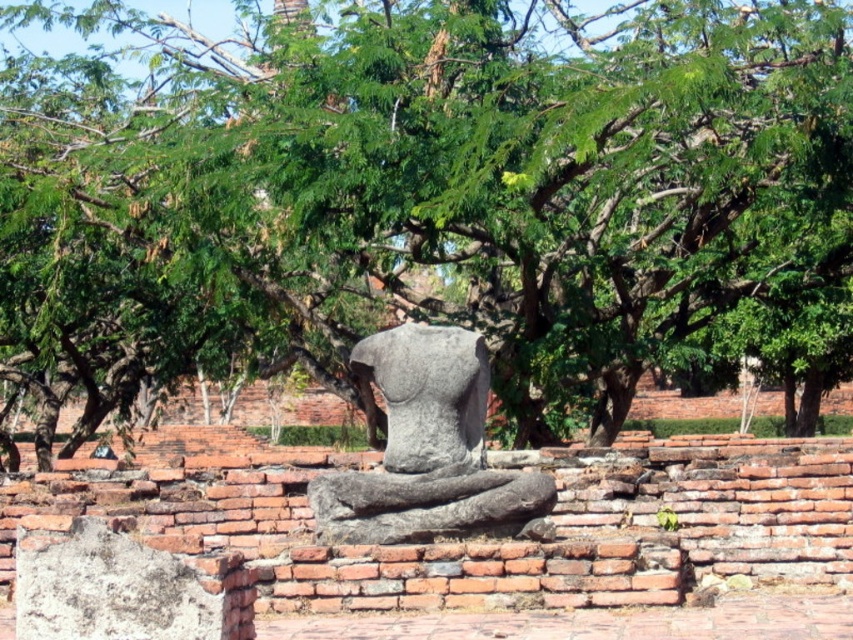
You are a visitor at the historical site and want to take a photo of the gray stone statue at center without the green leafy tree at center blocking the view. Is there a way to position yourself so that the statue is visible but the tree is not in the frame?

The gray stone statue at center is behind the green leafy tree at center, so you can position yourself in front of the tree to capture the statue without the tree blocking the view.

You are a photographer planning to capture the gray stone statue at center and the green leafy tree at center in a single frame. Based on their positions, can you determine which object is closer to the camera?

The green leafy tree at center is located above the gray stone statue at center, so the statue is closer to the camera since objects lower in the frame are typically nearer.